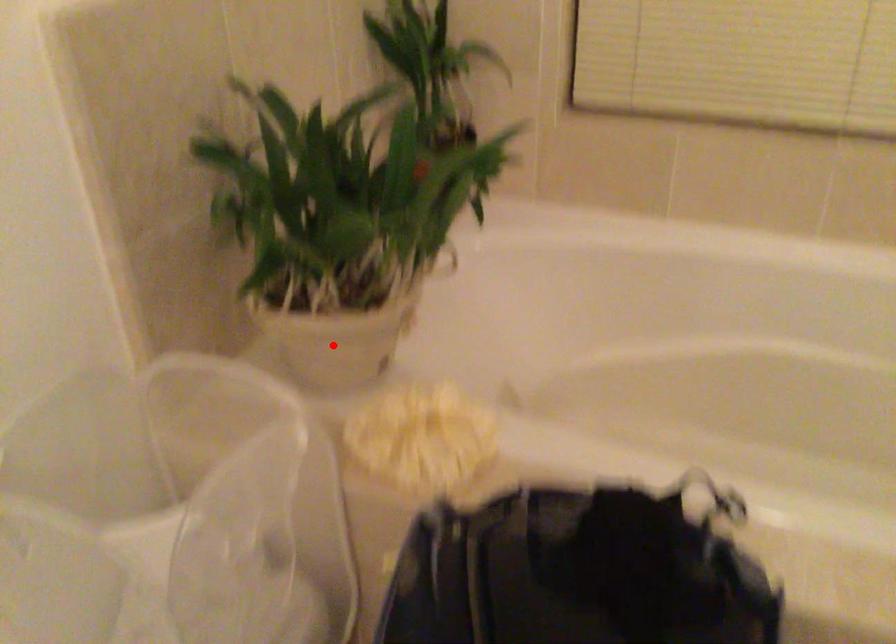
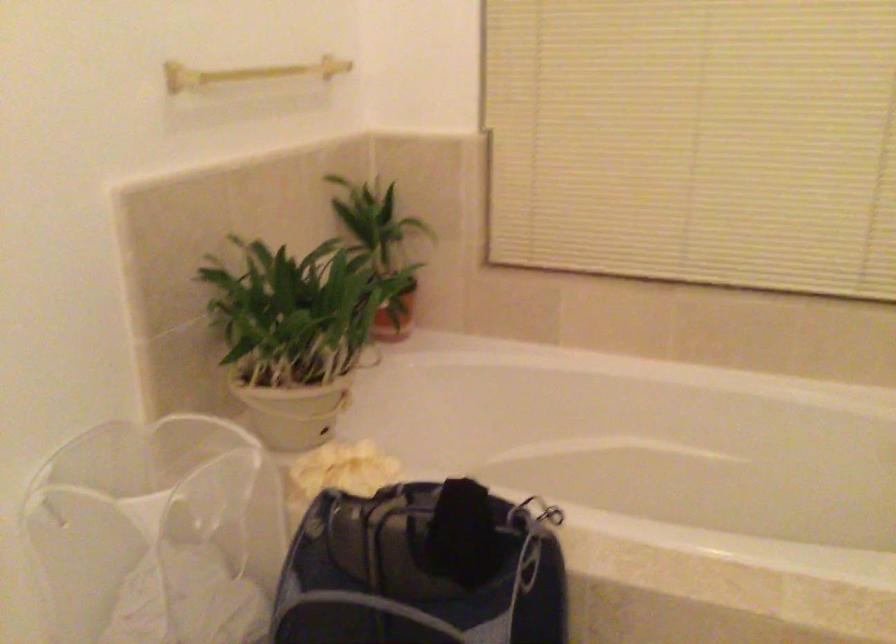
Find the pixel in the second image that matches the highlighted location in the first image.

(289, 410)